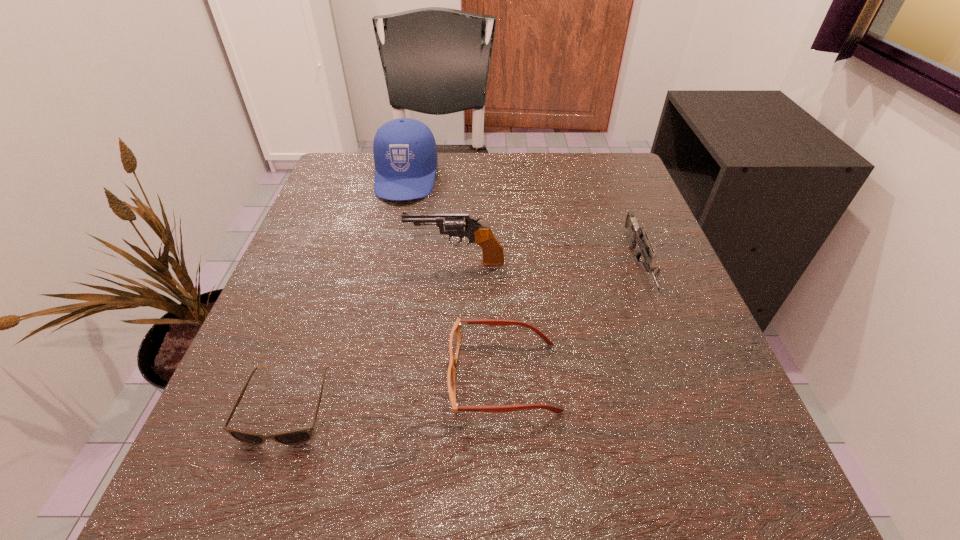
Locate an element on the screen. The height and width of the screenshot is (540, 960). vacant space that satisfies the following two spatial constraints: 1. on the front-facing side of the farthest object; 2. along the barrel of the left gun is located at coordinates (387, 261).

Identify the location of vacant space that satisfies the following two spatial constraints: 1. along the barrel of the left gun; 2. on the front-facing side of the farthest object. (461, 178).

Where is `free region that satisfies the following two spatial constraints: 1. on the front-facing side of the farthest object; 2. along the barrel of the taller gun`? The image size is (960, 540). free region that satisfies the following two spatial constraints: 1. on the front-facing side of the farthest object; 2. along the barrel of the taller gun is located at coordinates (387, 261).

This screenshot has height=540, width=960. I want to click on free space that satisfies the following two spatial constraints: 1. aimed along the barrel of the shorter gun; 2. on the front-facing side of the spectacles, so click(682, 377).